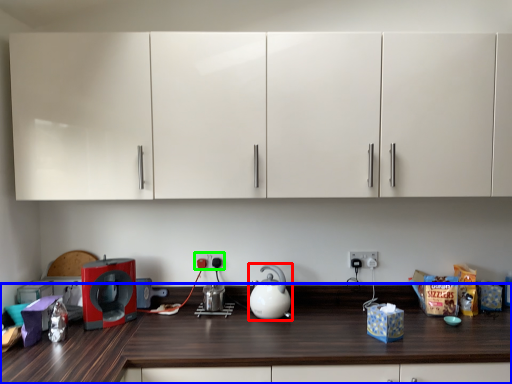
Question: Considering the real-world distances, which object is farthest from kitchen appliance (highlighted by a red box)? countertop (highlighted by a blue box) or electric outlet (highlighted by a green box)?

Choices:
 (A) countertop
 (B) electric outlet

Answer: (A)